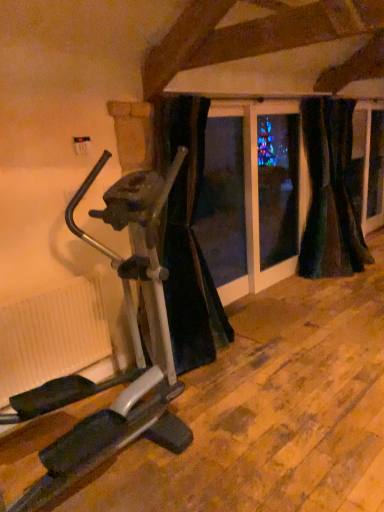
Question: Considering the relative sizes of white ribbed radiator at lower left and velvet dark green curtain at right, marked as the third curtain in a left-to-right arrangement, in the image provided, is white ribbed radiator at lower left thinner than velvet dark green curtain at right, marked as the third curtain in a left-to-right arrangement,?

Choices:
 (A) no
 (B) yes

Answer: (B)

Question: Considering the relative sizes of white ribbed radiator at lower left and velvet dark green curtain at right, marked as the third curtain in a left-to-right arrangement, in the image provided, is white ribbed radiator at lower left shorter than velvet dark green curtain at right, marked as the third curtain in a left-to-right arrangement,?

Choices:
 (A) yes
 (B) no

Answer: (A)

Question: Considering the relative sizes of white ribbed radiator at lower left and velvet dark green curtain at right, positioned as the 1th curtain in right-to-left order, in the image provided, is white ribbed radiator at lower left smaller than velvet dark green curtain at right, positioned as the 1th curtain in right-to-left order,?

Choices:
 (A) no
 (B) yes

Answer: (B)

Question: Is white ribbed radiator at lower left positioned with its back to velvet dark green curtain at right, marked as the third curtain in a left-to-right arrangement?

Choices:
 (A) yes
 (B) no

Answer: (B)

Question: Considering the relative positions of white ribbed radiator at lower left and velvet dark green curtain at right, marked as the third curtain in a left-to-right arrangement, in the image provided, is white ribbed radiator at lower left to the right of velvet dark green curtain at right, marked as the third curtain in a left-to-right arrangement, from the viewer's perspective?

Choices:
 (A) no
 (B) yes

Answer: (A)

Question: From a real-world perspective, is velvet dark green curtain at right, acting as the second curtain starting from the left, positioned above or below black velvet curtain at center, which is the 3th curtain in right-to-left order?

Choices:
 (A) above
 (B) below

Answer: (A)

Question: Considering the positions of velvet dark green curtain at right, the 2th curtain positioned from the right, and black velvet curtain at center, which is counted as the first curtain, starting from the left, in the image, is velvet dark green curtain at right, the 2th curtain positioned from the right, bigger or smaller than black velvet curtain at center, which is counted as the first curtain, starting from the left,?

Choices:
 (A) big
 (B) small

Answer: (B)

Question: Considering their positions, is velvet dark green curtain at right, the 2th curtain positioned from the right, located in front of or behind black velvet curtain at center, which is counted as the first curtain, starting from the left?

Choices:
 (A) behind
 (B) front

Answer: (A)

Question: From the image's perspective, relative to black velvet curtain at center, which is the 3th curtain in right-to-left order, is velvet dark green curtain at right, acting as the second curtain starting from the left, above or below?

Choices:
 (A) below
 (B) above

Answer: (B)

Question: In terms of height, does silver metallic stationary bicycle at left look taller or shorter compared to black velvet curtain at center, which is the 3th curtain in right-to-left order?

Choices:
 (A) short
 (B) tall

Answer: (A)

Question: Visually, is silver metallic stationary bicycle at left positioned to the left or to the right of black velvet curtain at center, which is the 3th curtain in right-to-left order?

Choices:
 (A) right
 (B) left

Answer: (B)

Question: Is silver metallic stationary bicycle at left inside or outside of black velvet curtain at center, which is counted as the first curtain, starting from the left?

Choices:
 (A) outside
 (B) inside

Answer: (A)

Question: Is silver metallic stationary bicycle at left in front of or behind black velvet curtain at center, which is the 3th curtain in right-to-left order, in the image?

Choices:
 (A) front
 (B) behind

Answer: (A)

Question: Considering the positions of black velvet curtain at center, which is the 3th curtain in right-to-left order, and white ribbed radiator at lower left in the image, is black velvet curtain at center, which is the 3th curtain in right-to-left order, bigger or smaller than white ribbed radiator at lower left?

Choices:
 (A) small
 (B) big

Answer: (B)

Question: Considering their positions, is black velvet curtain at center, which is counted as the first curtain, starting from the left, located in front of or behind white ribbed radiator at lower left?

Choices:
 (A) front
 (B) behind

Answer: (B)